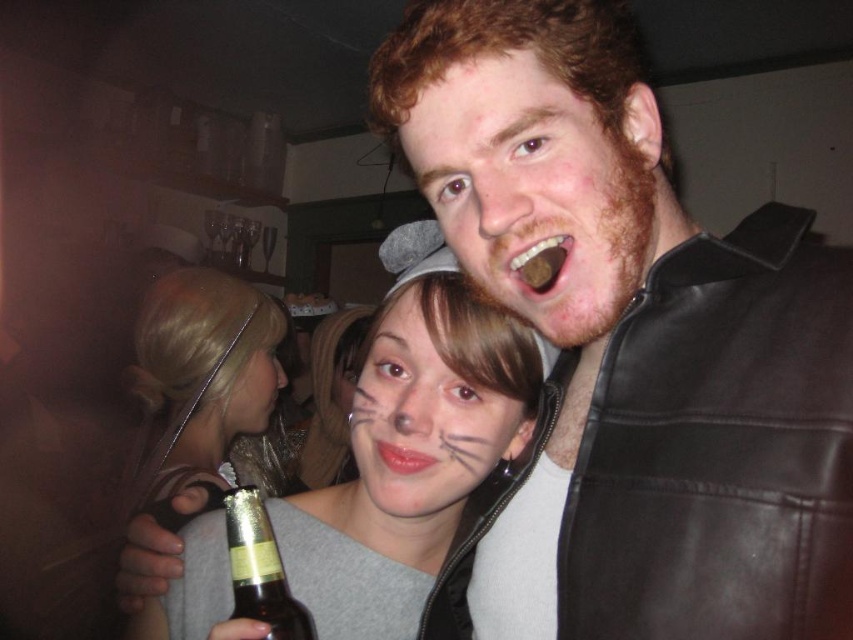
You are at a party and want to grab the brown matte chocolate at upper center without moving the matte gray hair at center. Is it possible?

The brown matte chocolate at upper center is behind the matte gray hair at center, so you can reach it without moving the matte gray hair at center as it is not blocking the chocolate.

Where is the black leather jacket at center located in the image?

The black leather jacket at center is located at point (630, 346) in the image.